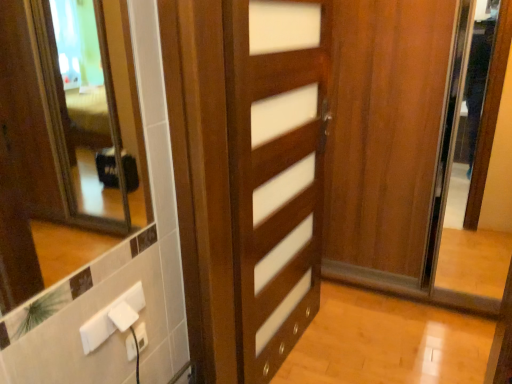
Question: Is point (103, 336) positioned closer to the camera than point (131, 344)?

Choices:
 (A) closer
 (B) farther

Answer: (A)

Question: In terms of size, does white plastic electric outlet at lower left, the 2th electric outlet in the bottom-to-top sequence, appear bigger or smaller than white plastic electric outlet at lower center, positioned as the second electric outlet in top-to-bottom order?

Choices:
 (A) small
 (B) big

Answer: (B)

Question: Which object is the closest to the white plastic electric outlet at lower left, the first electric outlet from the top?

Choices:
 (A) wooden door at center
 (B) white plastic electric outlet at lower center, which is counted as the first electric outlet, starting from the bottom

Answer: (B)

Question: Estimate the real-world distances between objects in this image. Which object is farther from the wooden door at center?

Choices:
 (A) white plastic electric outlet at lower center, positioned as the second electric outlet in top-to-bottom order
 (B) white plastic electric outlet at lower left, the 2th electric outlet in the bottom-to-top sequence

Answer: (A)